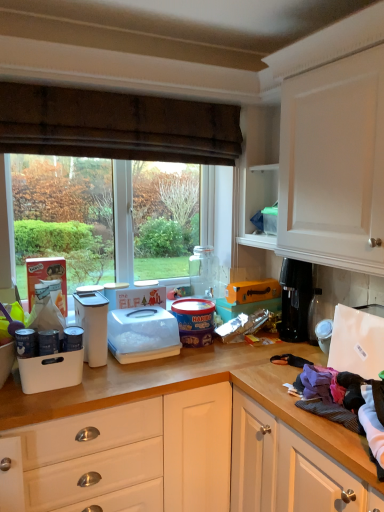
Question: Is orange cardboard box at center, positioned as the first box in top-to-bottom order, not near brown textured curtain at upper center?

Choices:
 (A) no
 (B) yes

Answer: (A)

Question: Is orange cardboard box at center, positioned as the first box in top-to-bottom order, in contact with brown textured curtain at upper center?

Choices:
 (A) yes
 (B) no

Answer: (B)

Question: From the image's perspective, is orange cardboard box at center, which is the 2th box in bottom-to-top order, located beneath brown textured curtain at upper center?

Choices:
 (A) no
 (B) yes

Answer: (B)

Question: Is brown textured curtain at upper center at the back of orange cardboard box at center, which is the 2th box in bottom-to-top order?

Choices:
 (A) yes
 (B) no

Answer: (B)

Question: Can you confirm if orange cardboard box at center, which is the 2th box in bottom-to-top order, is bigger than brown textured curtain at upper center?

Choices:
 (A) yes
 (B) no

Answer: (B)

Question: Based on their sizes in the image, would you say orange matte box at center, placed as the 1th box when sorted from bottom to top, is bigger or smaller than transparent glass window at center?

Choices:
 (A) big
 (B) small

Answer: (B)

Question: Is orange matte box at center, placed as the 1th box when sorted from bottom to top, taller or shorter than transparent glass window at center?

Choices:
 (A) short
 (B) tall

Answer: (A)

Question: Considering their positions, is orange matte box at center, which is the 2th box from top to bottom, located in front of or behind transparent glass window at center?

Choices:
 (A) front
 (B) behind

Answer: (B)

Question: Is orange matte box at center, placed as the 1th box when sorted from bottom to top, inside the boundaries of transparent glass window at center, or outside?

Choices:
 (A) outside
 (B) inside

Answer: (A)

Question: From their relative heights in the image, would you say white plastic bread bin at center, acting as the third appliance starting from the left, is taller or shorter than black plastic coffee maker at right, arranged as the 6th appliance when viewed from the left?

Choices:
 (A) short
 (B) tall

Answer: (A)

Question: Which is correct: white plastic bread bin at center, the fifth appliance positioned from the right, is inside black plastic coffee maker at right, arranged as the 6th appliance when viewed from the left, or outside of it?

Choices:
 (A) inside
 (B) outside

Answer: (B)

Question: Is white plastic bread bin at center, acting as the third appliance starting from the left, to the left or to the right of black plastic coffee maker at right, the second appliance in the right-to-left sequence, in the image?

Choices:
 (A) right
 (B) left

Answer: (B)

Question: Is white plastic bread bin at center, acting as the third appliance starting from the left, in front of or behind black plastic coffee maker at right, arranged as the 6th appliance when viewed from the left, in the image?

Choices:
 (A) front
 (B) behind

Answer: (B)

Question: From a real-world perspective, relative to transparent glass window at center, is black plastic coffee maker at right, the second appliance in the right-to-left sequence, vertically above or below?

Choices:
 (A) above
 (B) below

Answer: (B)

Question: Choose the correct answer: Is black plastic coffee maker at right, the second appliance in the right-to-left sequence, inside transparent glass window at center or outside it?

Choices:
 (A) inside
 (B) outside

Answer: (B)